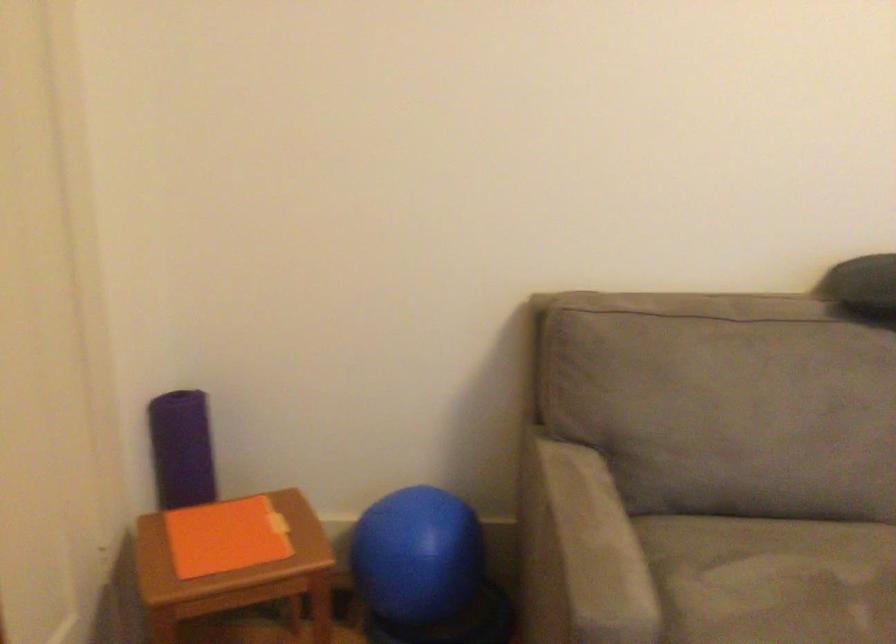
What are the coordinates of `blue exercise ball` in the screenshot? It's located at (417, 554).